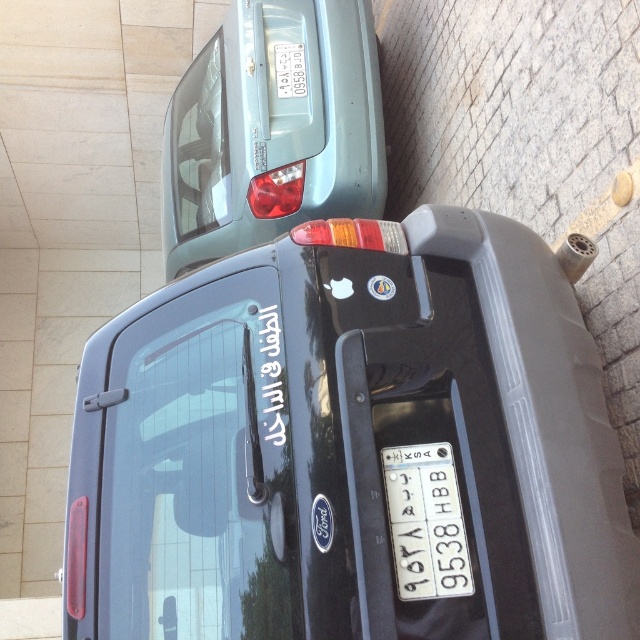
Question: In this image, where is satin metallic car at upper center located relative to white plastic license plate at center?

Choices:
 (A) below
 (B) above

Answer: (B)

Question: Which point appears closest to the camera in this image?

Choices:
 (A) (333, 204)
 (B) (381, 458)

Answer: (B)

Question: Can you confirm if satin metallic car at upper center is positioned to the right of white plastic license plate at center?

Choices:
 (A) no
 (B) yes

Answer: (A)

Question: Can you confirm if satin metallic car at upper center is bigger than white plastic license plate at center?

Choices:
 (A) yes
 (B) no

Answer: (A)

Question: Which point is farther to the camera?

Choices:
 (A) satin metallic car at upper center
 (B) white plastic license plate at center

Answer: (A)

Question: Which of the following is the closest to the observer?

Choices:
 (A) (179, 260)
 (B) (452, 484)

Answer: (B)